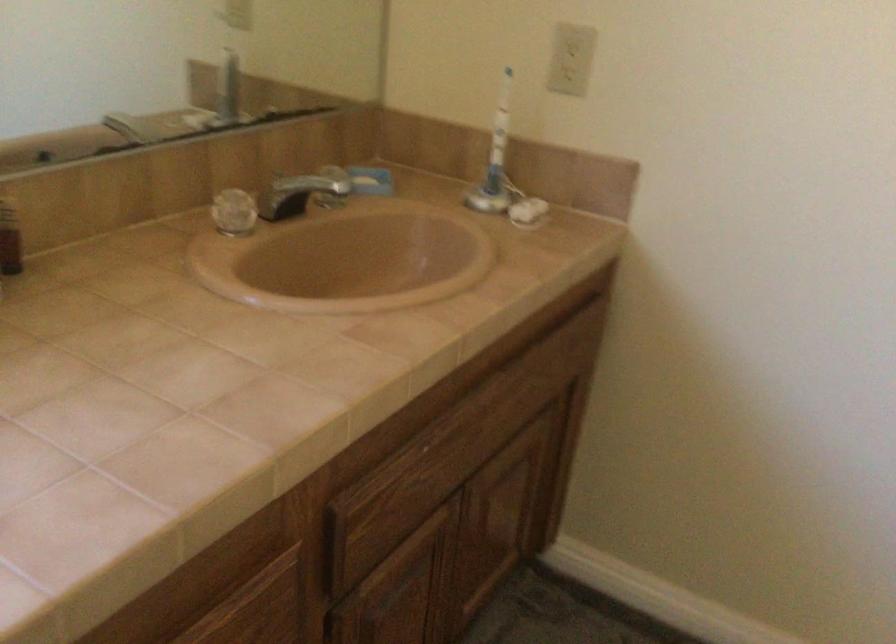
You are a GUI agent. You are given a task and a screenshot of the screen. Output one action in this format:
    pyautogui.click(x=<x>, y=<y>)
    Task: Click on the electrical outlet
    
    Given the screenshot: What is the action you would take?
    pyautogui.click(x=567, y=75)